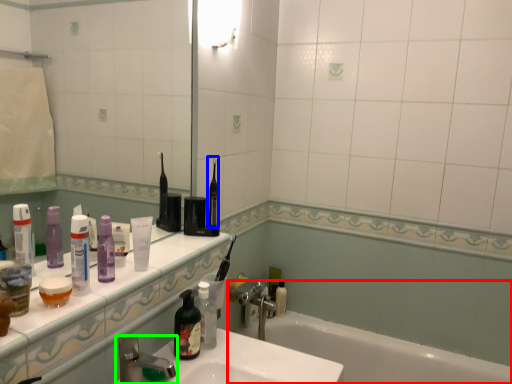
Question: Based on their relative distances, which object is farther from bathtub (highlighted by a red box)? Choose from toothbrush (highlighted by a blue box) and tap (highlighted by a green box).

Choices:
 (A) toothbrush
 (B) tap

Answer: (B)